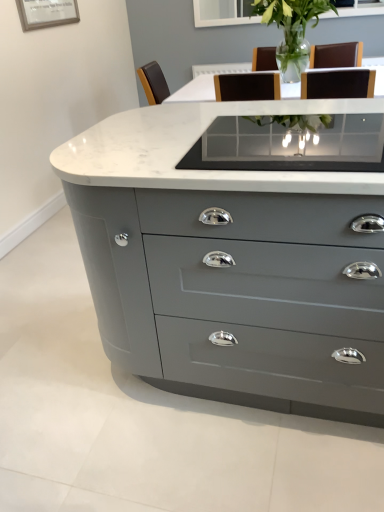
This screenshot has width=384, height=512. Identify the location of vacant space positioned to the left of matte gray chest of drawers at center. (60, 365).